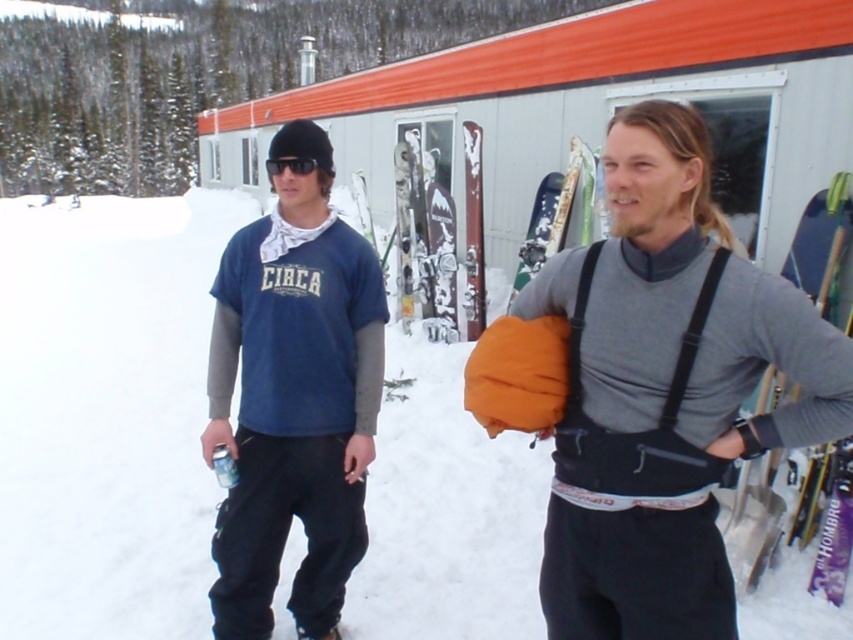
Question: Is matte blue sweatshirt at center positioned at the back of matte blue t-shirt at center?

Choices:
 (A) no
 (B) yes

Answer: (A)

Question: Which point appears closest to the camera in this image?

Choices:
 (A) (320, 362)
 (B) (720, 428)

Answer: (B)

Question: Which of the following is the closest to the observer?

Choices:
 (A) matte blue t-shirt at center
 (B) matte blue sweatshirt at center

Answer: (B)

Question: Does matte blue sweatshirt at center appear over matte blue t-shirt at center?

Choices:
 (A) yes
 (B) no

Answer: (A)

Question: Is matte blue sweatshirt at center above matte blue t-shirt at center?

Choices:
 (A) no
 (B) yes

Answer: (B)